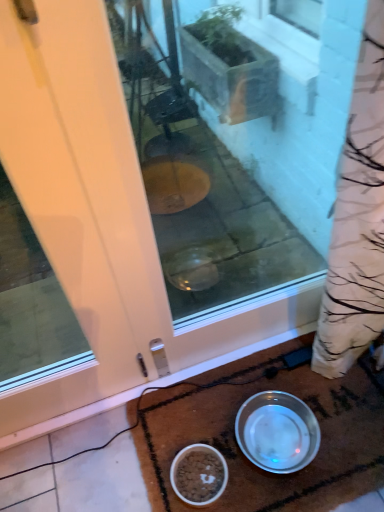
Locate an element on the screen. Image resolution: width=384 pixels, height=512 pixels. vacant space underneath white glossy door at center (from a real-world perspective) is located at coordinates (81, 413).